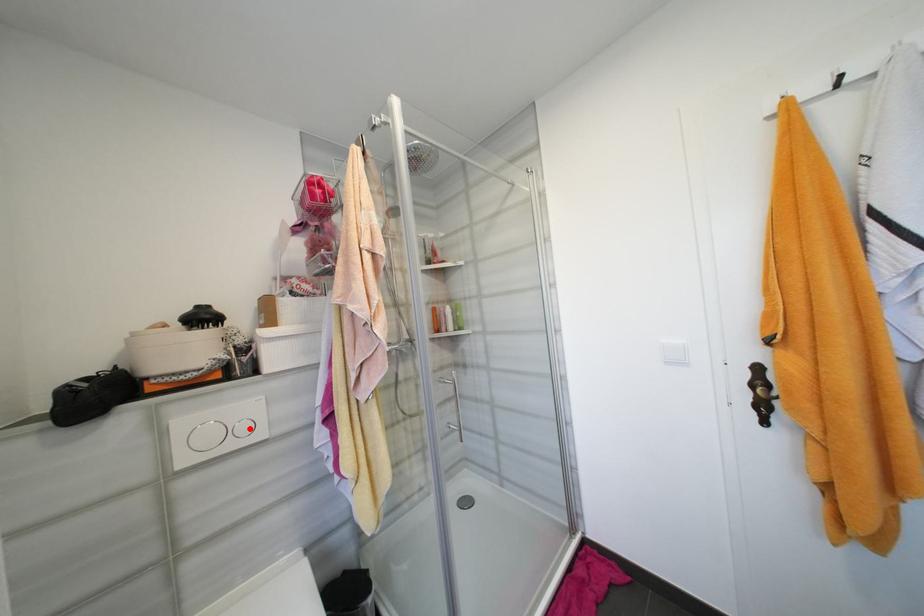
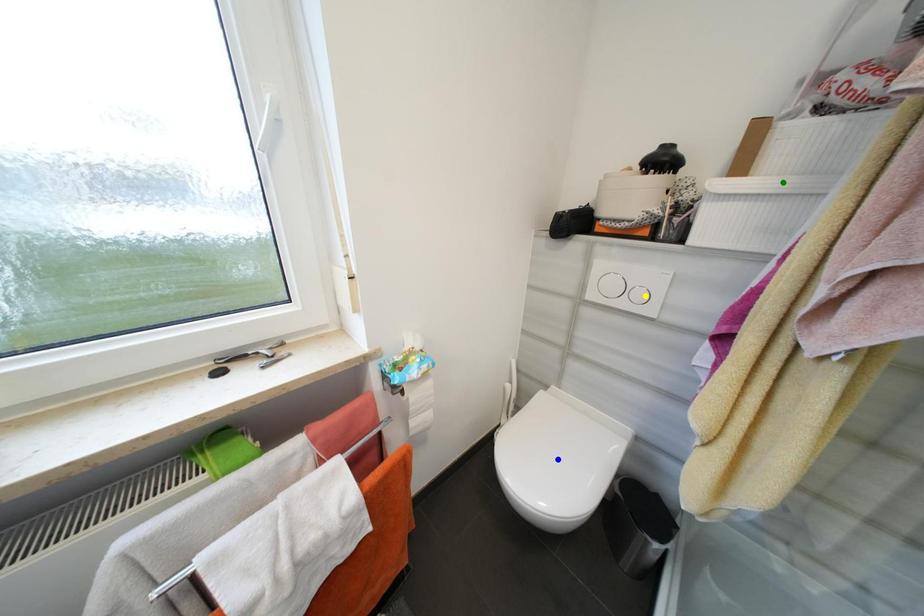
Question: I am providing you with two images of the same scene from different viewpoints. A red point is marked on the first image. You are given multiple points on the second image. Which point in image 2 represents the same 3d spot as the red point in image 1?

Choices:
 (A) yellow point
 (B) green point
 (C) blue point

Answer: (A)